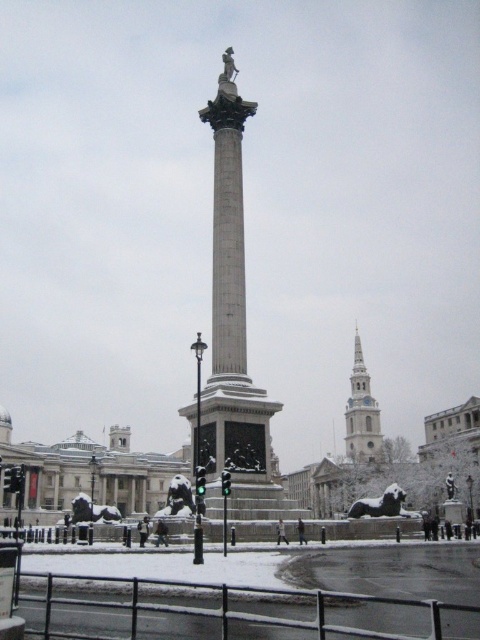
From the picture: You are standing in Trafalgar Square, looking at the snow covered lions and the monument. There are two points marked on the ground. One is at coordinates point (210, 467) and the other at point (387, 512). If you were to walk from the first point towards the monument, would you pass by the second point?

Point (210, 467) is in front of point (387, 512). Therefore, walking from the first point towards the monument, you would pass by the second point because it is behind the first point relative to the monument.

You are standing in Trafalgar Square on a snowy day. You see the smooth stone column at center. Where is it located in the square?

The smooth stone column at center is located at point 0.523 in the x coordinate and 0.485 in the y coordinate.